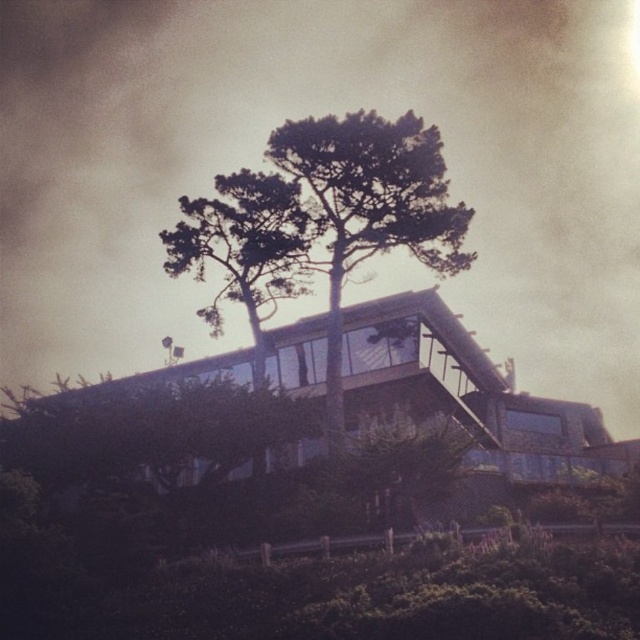
Which of these two, green leafy tree at center or dark green leafy tree at center, stands shorter?

With less height is dark green leafy tree at center.

Which is more to the right, green leafy tree at center or dark green leafy tree at center?

green leafy tree at center

Which is behind, point (328, 384) or point (304, 212)?

Positioned behind is point (304, 212).

Locate an element on the screen. The width and height of the screenshot is (640, 640). green leafy tree at center is located at coordinates (369, 209).

Which of these two, dark gray cloud at upper center or green leafy tree at center, stands taller?

With more height is dark gray cloud at upper center.

Which is behind, point (58, 209) or point (336, 168)?

Positioned behind is point (58, 209).

Image resolution: width=640 pixels, height=640 pixels. Find the location of `dark gray cloud at upper center`. dark gray cloud at upper center is located at coordinates (321, 113).

Does point (90, 285) come farther from viewer compared to point (253, 243)?

Yes, point (90, 285) is behind point (253, 243).

Can you confirm if dark gray cloud at upper center is wider than dark green leafy tree at center?

Yes, dark gray cloud at upper center is wider than dark green leafy tree at center.

This screenshot has width=640, height=640. Describe the element at coordinates (321, 113) in the screenshot. I see `dark gray cloud at upper center` at that location.

Where is `dark gray cloud at upper center`? Image resolution: width=640 pixels, height=640 pixels. dark gray cloud at upper center is located at coordinates (321, 113).